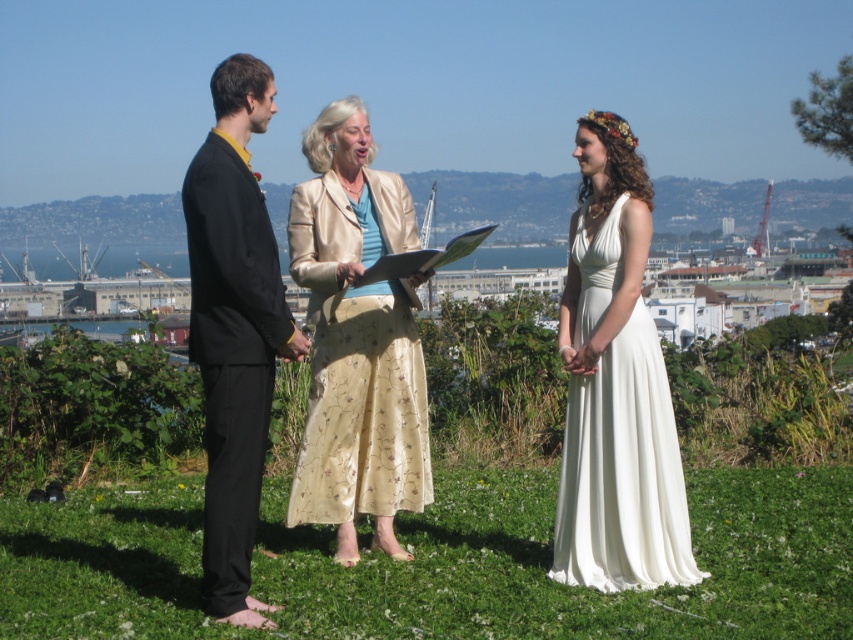
You are attending a wedding ceremony on a grassy hillside overlooking a city and water. You notice two guests dressed in a matte black suit at left and an ivory satin dress at center. Which guest is wearing clothing with a narrower silhouette?

The matte black suit at left has a lesser width compared to the ivory satin dress at center, so the guest in the matte black suit at left is wearing clothing with a narrower silhouette.

What is the color of the suit worn by the person at the point marked as coordinates (357, 339)?

The suit at coordinates (357, 339) is matte black.